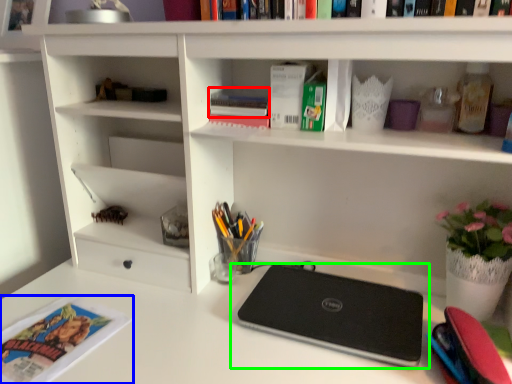
Question: Estimate the real-world distances between objects in this image. Which object is closer to book (highlighted by a red box), magazine (highlighted by a blue box) or laptop (highlighted by a green box)?

Choices:
 (A) magazine
 (B) laptop

Answer: (B)